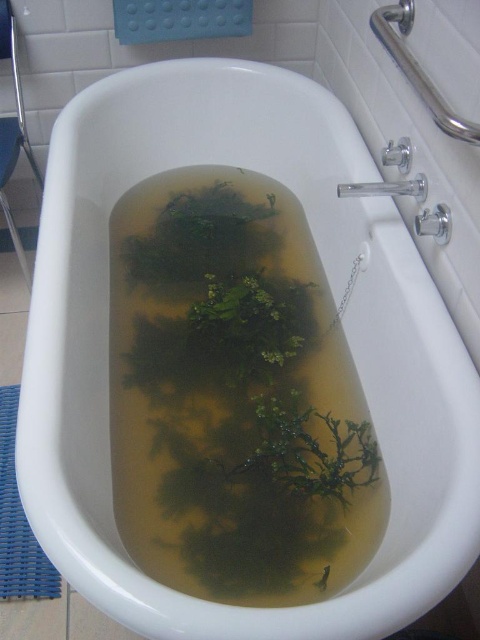
Question: Which object is farther from the camera taking this photo?

Choices:
 (A) green murky water at center
 (B) blue woven mat at lower left

Answer: (B)

Question: Can you confirm if green murky water at center is positioned to the right of blue woven mat at lower left?

Choices:
 (A) no
 (B) yes

Answer: (B)

Question: From the image, what is the correct spatial relationship of green murky water at center in relation to blue woven mat at lower left?

Choices:
 (A) left
 (B) right

Answer: (B)

Question: Which point is farther to the camera?

Choices:
 (A) green murky water at center
 (B) blue woven mat at lower left

Answer: (B)

Question: Which of the following is the closest to the observer?

Choices:
 (A) (0, 504)
 (B) (156, 275)

Answer: (A)

Question: Does green murky water at center have a smaller size compared to blue woven mat at lower left?

Choices:
 (A) no
 (B) yes

Answer: (A)